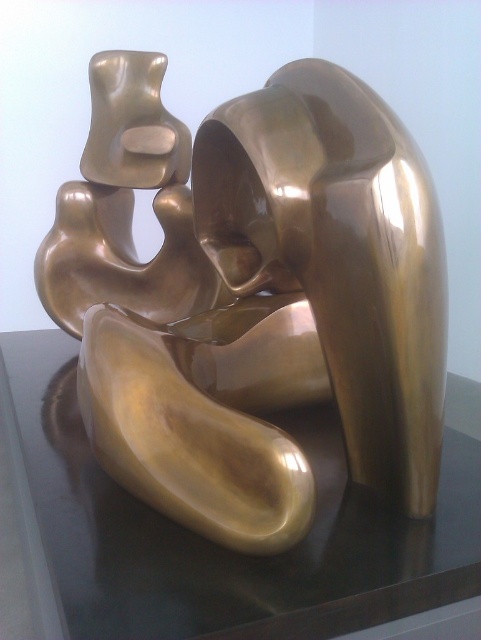
Question: Is gold polished sculpture at center positioned behind transparent glass table at center?

Choices:
 (A) yes
 (B) no

Answer: (A)

Question: Which point is farther to the camera?

Choices:
 (A) (126, 372)
 (B) (194, 563)

Answer: (A)

Question: Does gold polished sculpture at center appear on the right side of transparent glass table at center?

Choices:
 (A) yes
 (B) no

Answer: (A)

Question: Can you confirm if gold polished sculpture at center is bigger than transparent glass table at center?

Choices:
 (A) yes
 (B) no

Answer: (B)